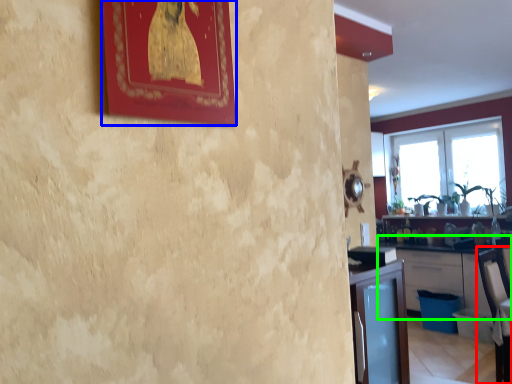
Question: Which object is positioned farthest from armchair (highlighted by a red box)? Select from picture frame (highlighted by a blue box) and cabinetry (highlighted by a green box).

Choices:
 (A) picture frame
 (B) cabinetry

Answer: (A)